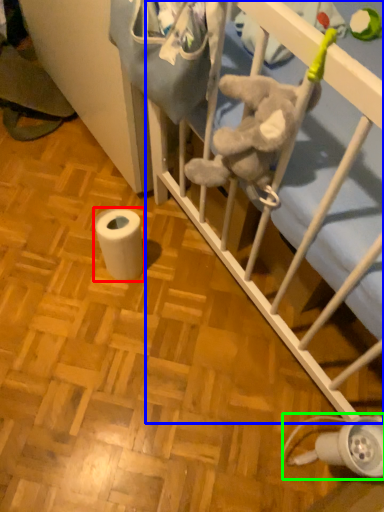
Question: Estimate the real-world distances between objects in this image. Which object is farther from toilet paper (highlighted by a red box), infant bed (highlighted by a blue box) or lamp (highlighted by a green box)?

Choices:
 (A) infant bed
 (B) lamp

Answer: (B)